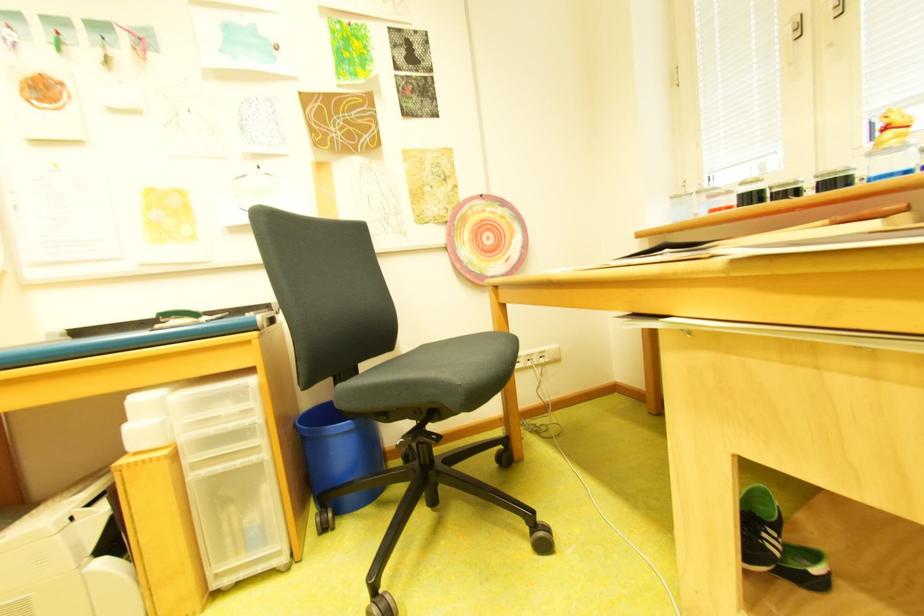
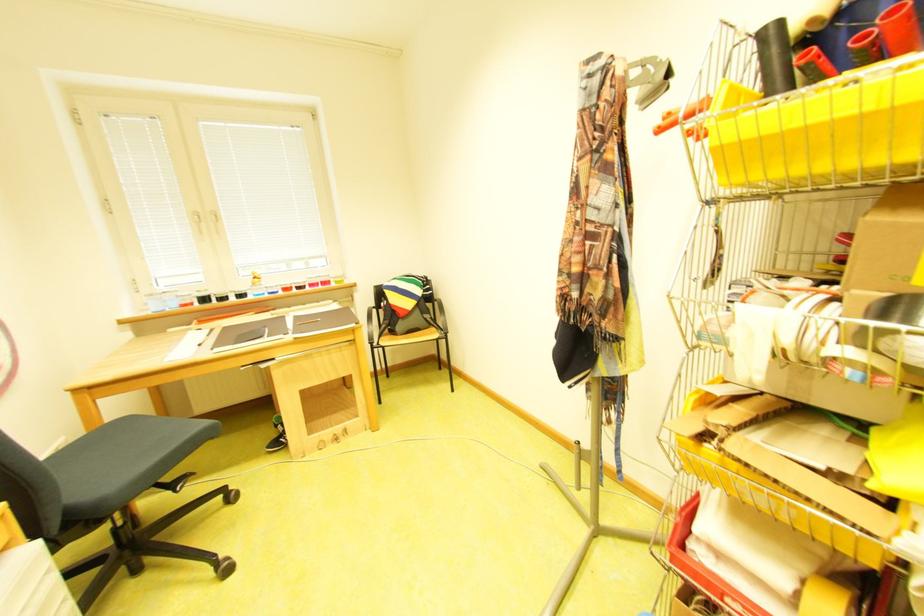
The point at [740,193] is marked in the first image. Where is the corresponding point in the second image?

(201, 296)